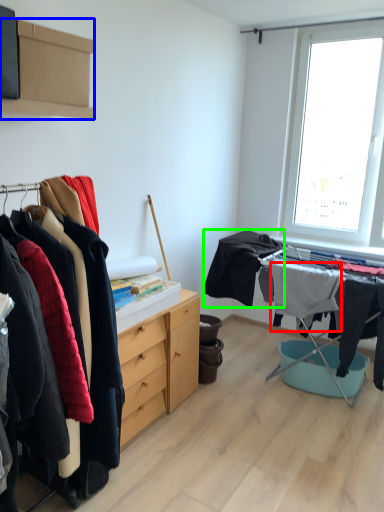
Question: Which object is the closest to the clothing (highlighted by a red box)? Choose among these: cabinetry (highlighted by a blue box) or clothing (highlighted by a green box).

Choices:
 (A) cabinetry
 (B) clothing

Answer: (B)